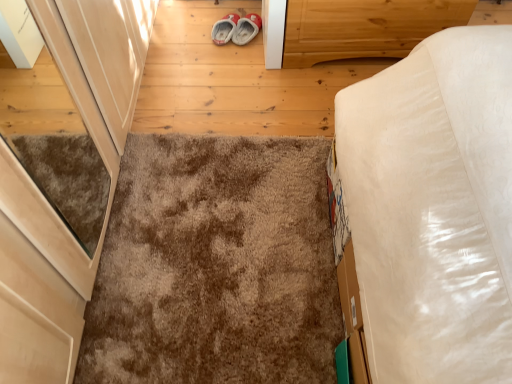
Question: Considering the positions of point (220, 198) and point (330, 11), is point (220, 198) closer or farther from the camera than point (330, 11)?

Choices:
 (A) closer
 (B) farther

Answer: (A)

Question: Would you say brown shaggy carpet at center is inside or outside light brown wood at upper right?

Choices:
 (A) inside
 (B) outside

Answer: (B)

Question: Is brown shaggy carpet at center taller or shorter than light brown wood at upper right?

Choices:
 (A) short
 (B) tall

Answer: (A)

Question: Is light brown wood at upper right taller or shorter than brown shaggy carpet at center?

Choices:
 (A) tall
 (B) short

Answer: (A)

Question: Considering the positions of light brown wood at upper right and brown shaggy carpet at center in the image, is light brown wood at upper right wider or thinner than brown shaggy carpet at center?

Choices:
 (A) wide
 (B) thin

Answer: (B)

Question: In the image, is light brown wood at upper right on the left side or the right side of brown shaggy carpet at center?

Choices:
 (A) left
 (B) right

Answer: (B)

Question: From a real-world perspective, is light brown wood at upper right above or below brown shaggy carpet at center?

Choices:
 (A) above
 (B) below

Answer: (A)